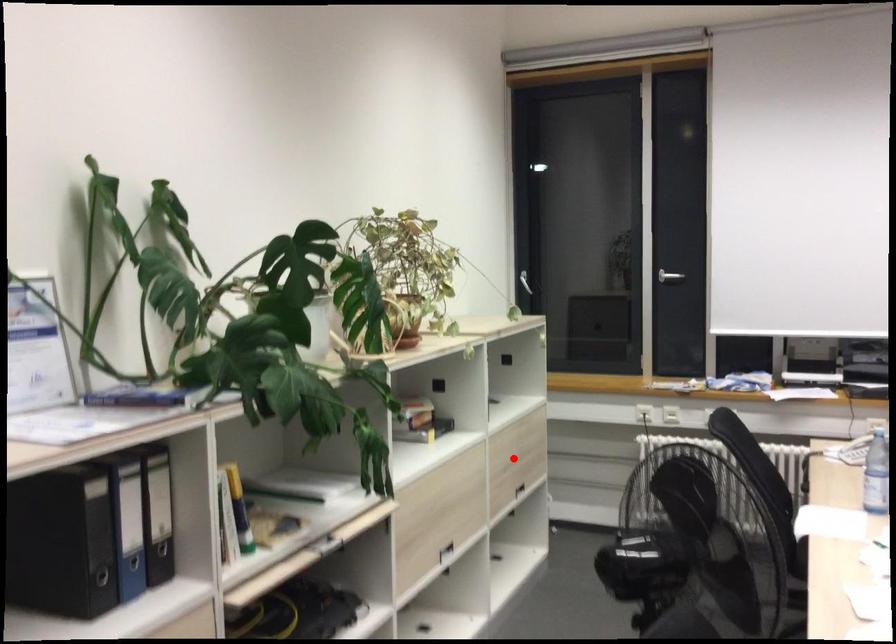
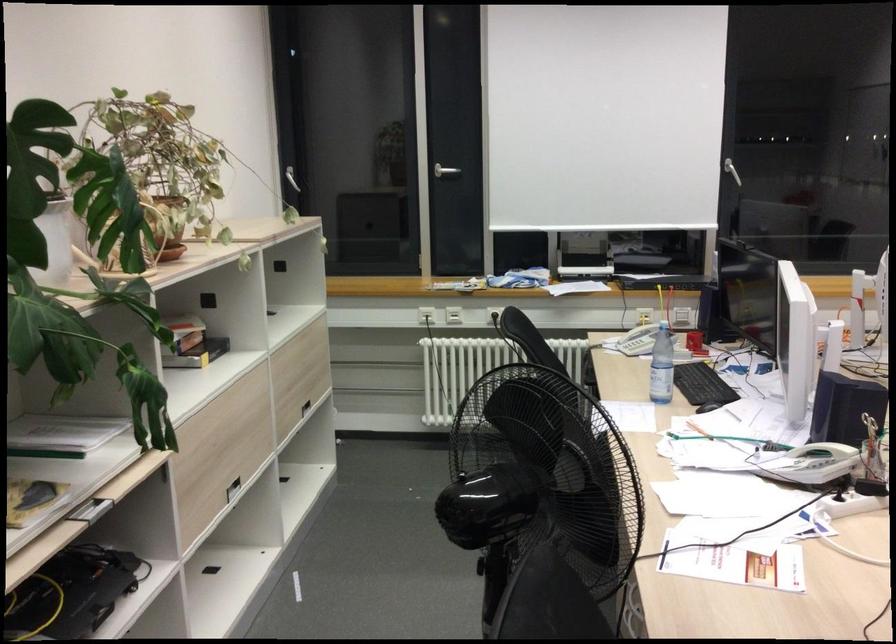
The point at the highlighted location is marked in the first image. Where is the corresponding point in the second image?

(298, 375)